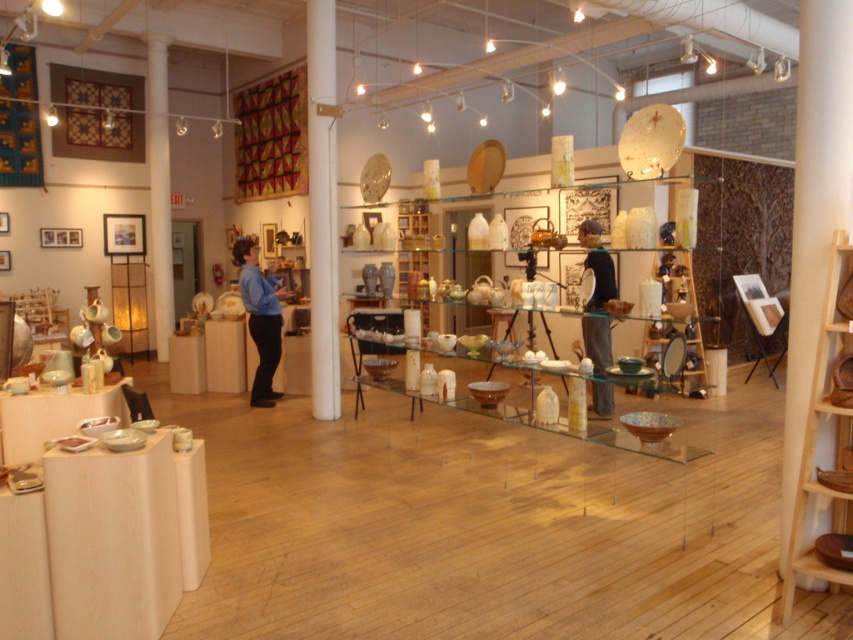
Can you confirm if transparent glass table at center is positioned to the left of black fabric shirt at center?

Correct, you'll find transparent glass table at center to the left of black fabric shirt at center.

This screenshot has width=853, height=640. Find the location of `transparent glass table at center`. transparent glass table at center is located at coordinates (492, 403).

Who is shorter, transparent glass table at center or blue shirt at center?

transparent glass table at center is shorter.

Can you confirm if transparent glass table at center is taller than blue shirt at center?

No.

Which is behind, point (364, 371) or point (257, 378)?

Point (364, 371)

Locate an element on the screen. This screenshot has height=640, width=853. transparent glass table at center is located at coordinates (492, 403).

Is the position of blue shirt at center less distant than that of black fabric shirt at center?

No, it is not.

Looking at this image, between blue shirt at center and black fabric shirt at center, which one appears on the right side from the viewer's perspective?

black fabric shirt at center

This screenshot has width=853, height=640. Identify the location of blue shirt at center. (260, 317).